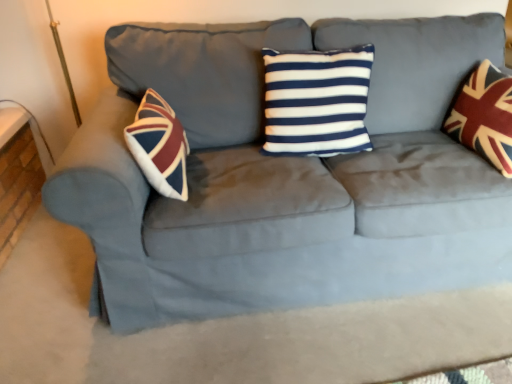
Find the location of `navy blue/white striped cushion at center`. navy blue/white striped cushion at center is located at coordinates (317, 101).

What do you see at coordinates (317, 101) in the screenshot? I see `navy blue/white striped cushion at center` at bounding box center [317, 101].

Where is `navy blue/white striped cushion at center`? The width and height of the screenshot is (512, 384). navy blue/white striped cushion at center is located at coordinates (317, 101).